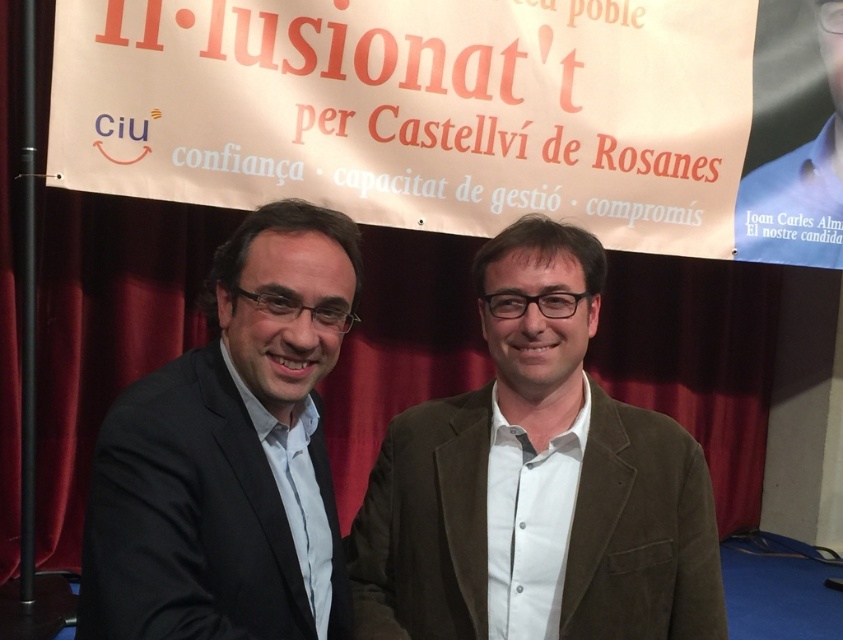
Question: Which point is closer to the camera?

Choices:
 (A) suede brown blazer at center
 (B) blue fabric at upper right
 (C) matte black suit at left

Answer: (C)

Question: Which is farther from the suede brown blazer at center?

Choices:
 (A) blue fabric at upper right
 (B) matte black suit at left

Answer: (A)

Question: Which point is closer to the camera?

Choices:
 (A) (277, 420)
 (B) (782, 42)

Answer: (A)

Question: Does matte black suit at left have a smaller size compared to blue fabric at upper right?

Choices:
 (A) yes
 (B) no

Answer: (A)

Question: Observing the image, what is the correct spatial positioning of matte black suit at left in reference to blue fabric at upper right?

Choices:
 (A) above
 (B) below

Answer: (B)

Question: Does suede brown blazer at center appear on the left side of matte black suit at left?

Choices:
 (A) no
 (B) yes

Answer: (A)